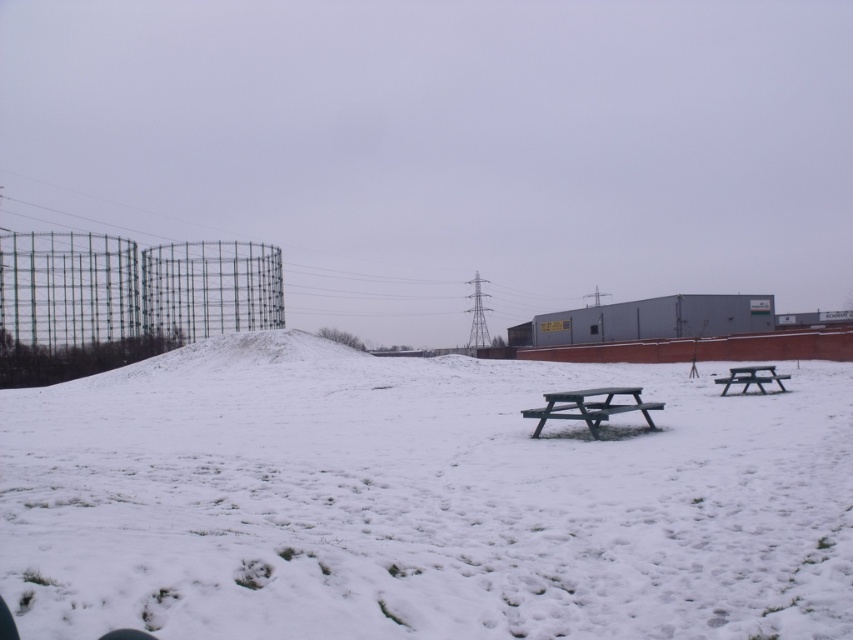
You are planning to set up a winter picnic and need to choose between the green plastic picnic table at center and the wooden picnic table at right. Based on their positions, which table is closer to the left side of the scene?

The green plastic picnic table at center is to the left of the wooden picnic table at right, so it is closer to the left side of the scene.

You are planning to set up a winter picnic and need to choose between the green plastic picnic table at center and the wooden picnic table at right. Which table has a larger width?

The wooden picnic table at right is wider than the green plastic picnic table at center.

You are planning to set up a winter picnic and need to place a blanket on the green plastic picnic table at center. However, there is white powdery snow at center on top of the table. Is the snow deep enough to cover the entire surface of the picnic table?

The white powdery snow at center is taller than green plastic picnic table at center, meaning the snow is deeper than the table height. This would likely bury the table completely, making it impossible to place the blanket on the table surface.